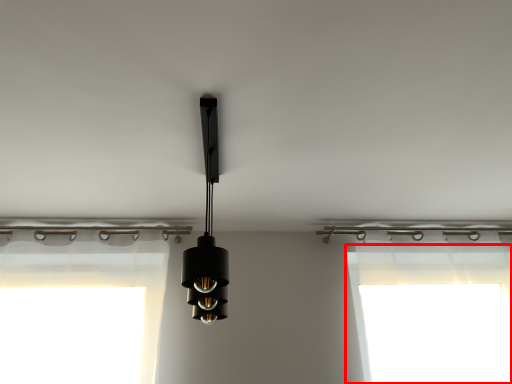
Question: From the image's perspective, considering the relative positions of window screen (annotated by the red box) and lamp in the image provided, where is window screen (annotated by the red box) located with respect to the staircase?

Choices:
 (A) below
 (B) above

Answer: (A)